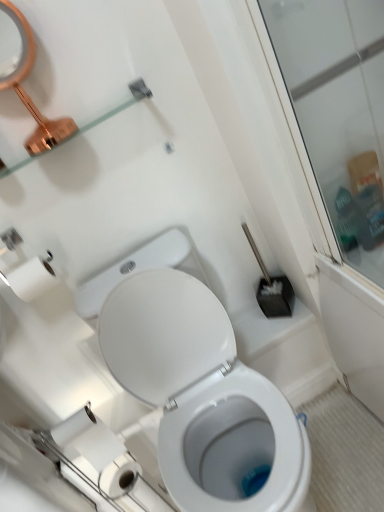
Question: From the image's perspective, is white glossy bidet at lower center above or below copper metallic mirror at upper left?

Choices:
 (A) below
 (B) above

Answer: (A)

Question: From a real-world perspective, is white glossy bidet at lower center physically located above or below copper metallic mirror at upper left?

Choices:
 (A) below
 (B) above

Answer: (A)

Question: Based on their relative distances, which object is nearer to the copper metallic mirror at upper left?

Choices:
 (A) white paper at lower left
 (B) white glossy toilet at center
 (C) white glossy bidet at lower center
 (D) clear glass shelf at upper left

Answer: (D)

Question: Which object is positioned farthest from the copper metallic mirror at upper left?

Choices:
 (A) white glossy toilet at center
 (B) clear glass shelf at upper left
 (C) white paper at lower left
 (D) white glossy bidet at lower center

Answer: (D)